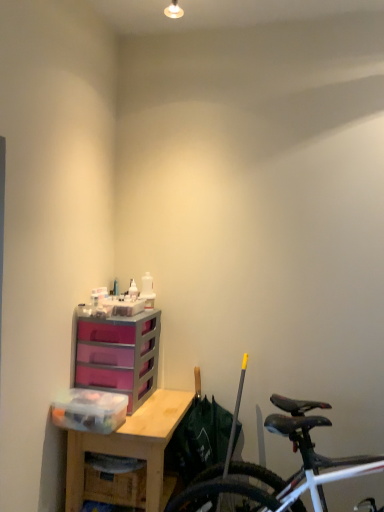
Question: Is transparent plastic storage box at left taller than purple plastic chest of drawers at center?

Choices:
 (A) no
 (B) yes

Answer: (A)

Question: Is transparent plastic storage box at left positioned in front of purple plastic chest of drawers at center?

Choices:
 (A) yes
 (B) no

Answer: (A)

Question: Is transparent plastic storage box at left next to purple plastic chest of drawers at center?

Choices:
 (A) no
 (B) yes

Answer: (A)

Question: Does transparent plastic storage box at left lie behind purple plastic chest of drawers at center?

Choices:
 (A) no
 (B) yes

Answer: (A)

Question: Can you confirm if transparent plastic storage box at left is thinner than purple plastic chest of drawers at center?

Choices:
 (A) no
 (B) yes

Answer: (B)

Question: Visually, is shiny black bicycle at lower right positioned to the left or to the right of wooden desk at center?

Choices:
 (A) left
 (B) right

Answer: (B)

Question: Do you think shiny black bicycle at lower right is within wooden desk at center, or outside of it?

Choices:
 (A) inside
 (B) outside

Answer: (B)

Question: From the image's perspective, is shiny black bicycle at lower right positioned above or below wooden desk at center?

Choices:
 (A) below
 (B) above

Answer: (B)

Question: Considering the positions of point click(x=306, y=487) and point click(x=112, y=433), is point click(x=306, y=487) closer or farther from the camera than point click(x=112, y=433)?

Choices:
 (A) farther
 (B) closer

Answer: (A)

Question: From the image's perspective, is purple plastic chest of drawers at center located above or below shiny black bicycle at lower right?

Choices:
 (A) above
 (B) below

Answer: (A)

Question: From a real-world perspective, is purple plastic chest of drawers at center positioned above or below shiny black bicycle at lower right?

Choices:
 (A) below
 (B) above

Answer: (B)

Question: Is purple plastic chest of drawers at center to the left or to the right of shiny black bicycle at lower right in the image?

Choices:
 (A) right
 (B) left

Answer: (B)

Question: From their relative heights in the image, would you say purple plastic chest of drawers at center is taller or shorter than shiny black bicycle at lower right?

Choices:
 (A) short
 (B) tall

Answer: (A)

Question: In terms of size, does shiny black bicycle at lower right appear bigger or smaller than transparent plastic storage box at left?

Choices:
 (A) small
 (B) big

Answer: (B)

Question: Is shiny black bicycle at lower right spatially inside transparent plastic storage box at left, or outside of it?

Choices:
 (A) outside
 (B) inside

Answer: (A)